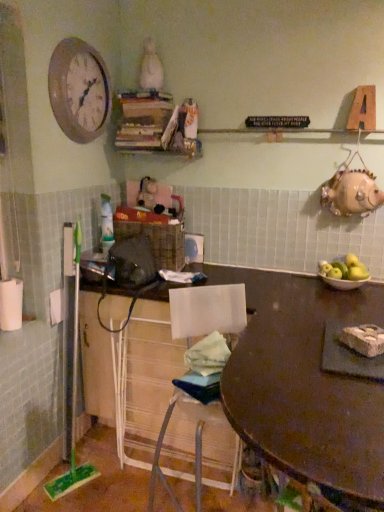
Question: Is white matte toilet paper at left wider than green matte apples at right?

Choices:
 (A) yes
 (B) no

Answer: (B)

Question: Is white matte toilet paper at left not inside green matte apples at right?

Choices:
 (A) yes
 (B) no

Answer: (A)

Question: Is white matte toilet paper at left facing away from green matte apples at right?

Choices:
 (A) yes
 (B) no

Answer: (B)

Question: Is white matte toilet paper at left at the right side of green matte apples at right?

Choices:
 (A) yes
 (B) no

Answer: (B)

Question: Does white matte toilet paper at left lie in front of green matte apples at right?

Choices:
 (A) yes
 (B) no

Answer: (A)

Question: From a real-world perspective, is white matte toilet paper at left physically below green matte apples at right?

Choices:
 (A) no
 (B) yes

Answer: (B)

Question: Does matte white bowl at right have a larger size compared to white matte toilet paper at left?

Choices:
 (A) no
 (B) yes

Answer: (B)

Question: Is matte white bowl at right further to camera compared to white matte toilet paper at left?

Choices:
 (A) yes
 (B) no

Answer: (A)

Question: Can you confirm if matte white bowl at right is smaller than white matte toilet paper at left?

Choices:
 (A) no
 (B) yes

Answer: (A)

Question: Does matte white bowl at right appear on the left side of white matte toilet paper at left?

Choices:
 (A) no
 (B) yes

Answer: (A)

Question: Is matte white bowl at right positioned before white matte toilet paper at left?

Choices:
 (A) no
 (B) yes

Answer: (A)

Question: Would you say matte white bowl at right contains white matte toilet paper at left?

Choices:
 (A) no
 (B) yes

Answer: (A)

Question: From the image's perspective, is matte white bowl at right above green matte apples at right?

Choices:
 (A) no
 (B) yes

Answer: (A)